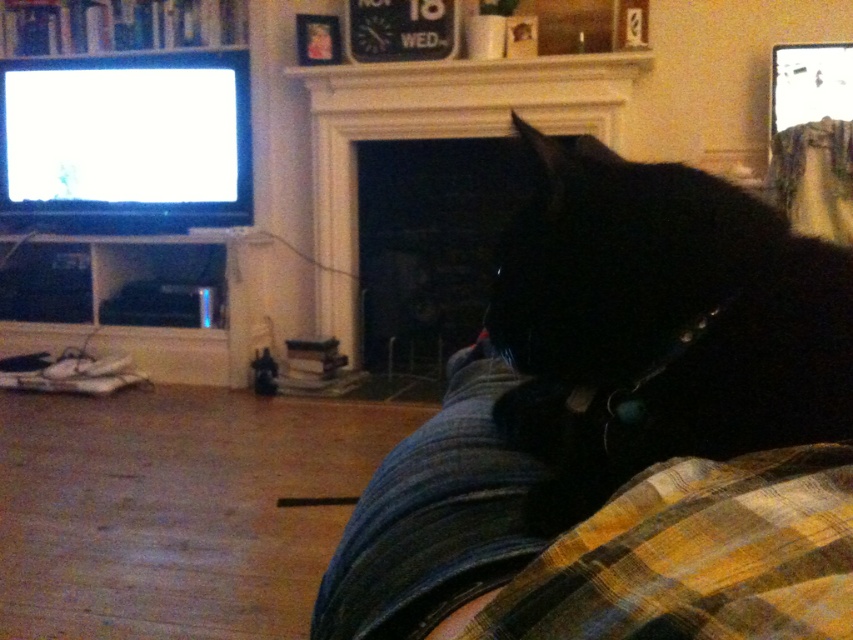
You are a photographer standing in the living room and want to take a closeup photo of the black fur cat at lower right. The camera you have can focus on objects within 20 inches. Can you take the photo without moving closer?

The black fur cat at lower right is 22.56 inches away from the viewer, which is beyond the camera focus range of 20 inches. Therefore, you cannot take the photo without moving closer.

You are a guest in this living room and want to place a small decorative item on the mantel above the white stone fireplace at center. However, you notice the plaid fabric at lower right. Where exactly should you place the item to ensure it is above the fireplace and not obstructed by the plaid fabric?

The plaid fabric at lower right is located below the white stone fireplace at center, so placing the decorative item on the mantel above the white stone fireplace at center will ensure it is positioned above the fireplace and not blocked by the plaid fabric.

In the scene shown: You are a photographer trying to capture a photo of the black fur cat at lower right and the white stone fireplace at center. Based on their heights, which object should you adjust your camera angle to look up at?

The white stone fireplace at center is taller than the black fur cat at lower right, so you should adjust your camera angle to look up at the white stone fireplace at center.